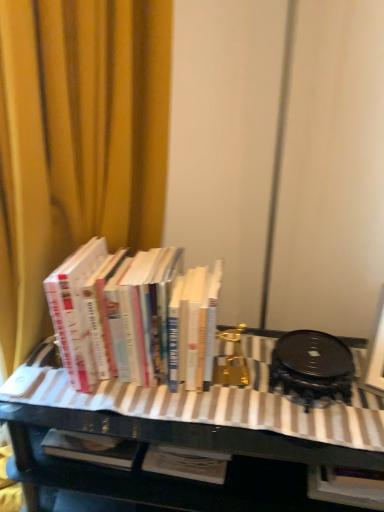
This screenshot has width=384, height=512. Find the location of `hardcover books at left`. hardcover books at left is located at coordinates (111, 311).

Locate an element on the screen. This screenshot has width=384, height=512. hardcover books at left is located at coordinates (111, 311).

Is point (83, 271) positioned behind point (34, 44)?

Yes, point (83, 271) is behind point (34, 44).

You are a GUI agent. You are given a task and a screenshot of the screen. Output one action in this format:
    pyautogui.click(x=<x>, y=<y>)
    Task: Click on the book on the right of yellow fabric curtain at upper left
    The width and height of the screenshot is (384, 512).
    Given the screenshot: What is the action you would take?
    pyautogui.click(x=111, y=311)

Between hardcover books at left and yellow fabric curtain at upper left, which one has more height?

yellow fabric curtain at upper left.

Considering the relative positions of yellow fabric curtain at upper left and black glossy table at center in the image provided, is yellow fabric curtain at upper left to the left of black glossy table at center from the viewer's perspective?

Correct, you'll find yellow fabric curtain at upper left to the left of black glossy table at center.

Is the depth of yellow fabric curtain at upper left greater than that of black glossy table at center?

No, yellow fabric curtain at upper left is closer to the camera.

From a real-world perspective, which is physically below, yellow fabric curtain at upper left or black glossy table at center?

black glossy table at center is physically lower.

From the image's perspective, who appears lower, yellow fabric curtain at upper left or black glossy table at center?

black glossy table at center appears lower in the image.

Is the surface of black glossy table at center in direct contact with hardcover books at left?

black glossy table at center and hardcover books at left are not in contact.

Is point (223, 445) closer or farther from the camera than point (145, 305)?

Point (223, 445).

Considering the positions of objects black glossy table at center and hardcover books at left in the image provided, who is behind, black glossy table at center or hardcover books at left?

hardcover books at left.

Is black glossy table at center oriented towards yellow fabric curtain at upper left?

No, black glossy table at center does not turn towards yellow fabric curtain at upper left.

Can you tell me how much black glossy table at center and yellow fabric curtain at upper left differ in facing direction?

The facing directions of black glossy table at center and yellow fabric curtain at upper left are 46.5 degrees apart.

Is point (205, 412) farther from camera compared to point (55, 181)?

No.

From the image's perspective, who appears lower, black glossy table at center or yellow fabric curtain at upper left?

black glossy table at center appears lower in the image.

Considering the relative positions of hardcover books at left and black glossy table at center in the image provided, is hardcover books at left in front of black glossy table at center?

No, hardcover books at left is further to the viewer.

From a real-world perspective, who is located lower, hardcover books at left or black glossy table at center?

From a 3D spatial view, black glossy table at center is below.

From the image's perspective, which one is positioned lower, hardcover books at left or black glossy table at center?

black glossy table at center appears lower in the image.

Which is correct: hardcover books at left is inside black glossy table at center, or outside of it?

hardcover books at left is spatially situated outside black glossy table at center.

Is yellow fabric curtain at upper left wider or thinner than hardcover books at left?

Clearly, yellow fabric curtain at upper left has more width compared to hardcover books at left.

Considering the relative positions of yellow fabric curtain at upper left and hardcover books at left in the image provided, is yellow fabric curtain at upper left to the right of hardcover books at left from the viewer's perspective?

Incorrect, yellow fabric curtain at upper left is not on the right side of hardcover books at left.

Where is `book that appears below the yellow fabric curtain at upper left (from the image's perspective)`? The image size is (384, 512). book that appears below the yellow fabric curtain at upper left (from the image's perspective) is located at coordinates (111, 311).

From the picture: From the image's perspective, is yellow fabric curtain at upper left beneath hardcover books at left?

Incorrect, from the image's perspective, yellow fabric curtain at upper left is higher than hardcover books at left.

Image resolution: width=384 pixels, height=512 pixels. I want to click on book on the right of yellow fabric curtain at upper left, so click(111, 311).

Image resolution: width=384 pixels, height=512 pixels. I want to click on table directly beneath the yellow fabric curtain at upper left (from a real-world perspective), so click(x=198, y=422).

Consider the image. Estimate the real-world distances between objects in this image. Which object is further from yellow fabric curtain at upper left, black glossy table at center or hardcover books at left?

Among the two, black glossy table at center is located further to yellow fabric curtain at upper left.

Looking at the image, which one is located closer to yellow fabric curtain at upper left, hardcover books at left or black glossy table at center?

hardcover books at left is closer to yellow fabric curtain at upper left.

Considering their positions, is yellow fabric curtain at upper left positioned closer to hardcover books at left than black glossy table at center?

Among the two, black glossy table at center is located nearer to hardcover books at left.

Based on their spatial positions, is black glossy table at center or yellow fabric curtain at upper left further from hardcover books at left?

yellow fabric curtain at upper left is further to hardcover books at left.

Looking at the image, which one is located closer to black glossy table at center, hardcover books at left or yellow fabric curtain at upper left?

Based on the image, hardcover books at left appears to be nearer to black glossy table at center.

Which object lies further to the anchor point black glossy table at center, yellow fabric curtain at upper left or hardcover books at left?

Among the two, yellow fabric curtain at upper left is located further to black glossy table at center.

Find the location of a particular element. The width and height of the screenshot is (384, 512). book between yellow fabric curtain at upper left and black glossy table at center from top to bottom is located at coordinates (111, 311).